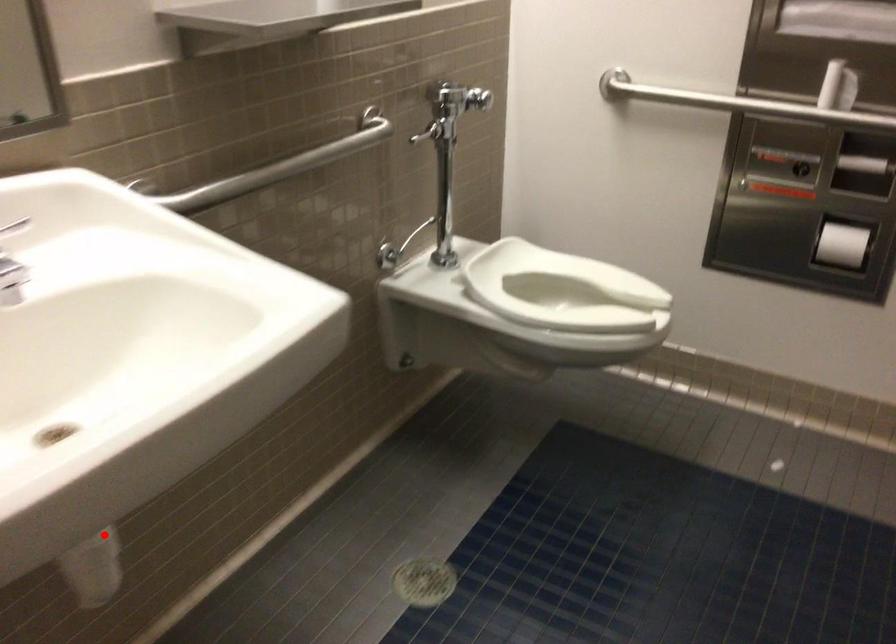
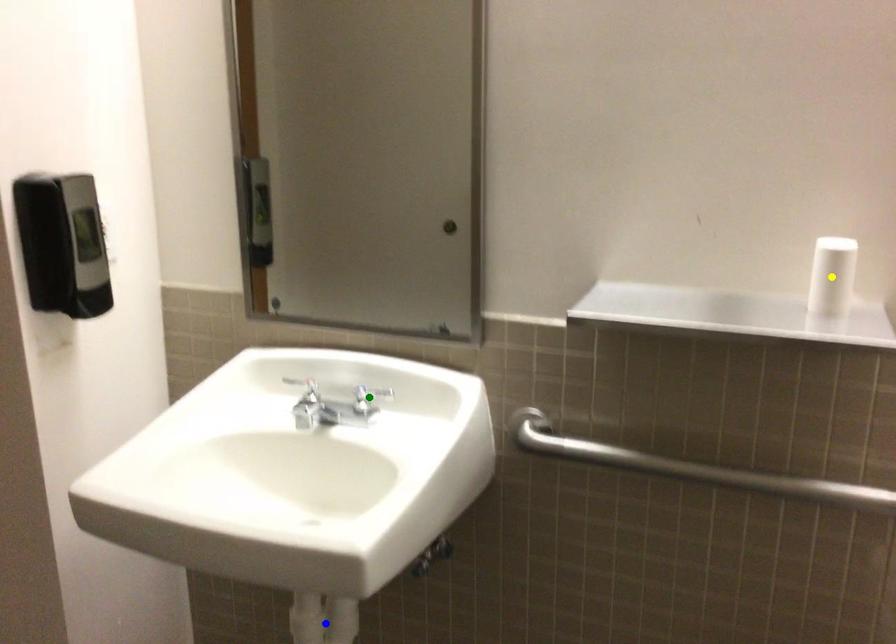
Question: I am providing you with two images of the same scene from different viewpoints. A red point is marked on the first image. You are given multiple points on the second image. In image 2, which mark is for the same physical point as the one in image 1?

Choices:
 (A) blue point
 (B) green point
 (C) yellow point

Answer: (A)